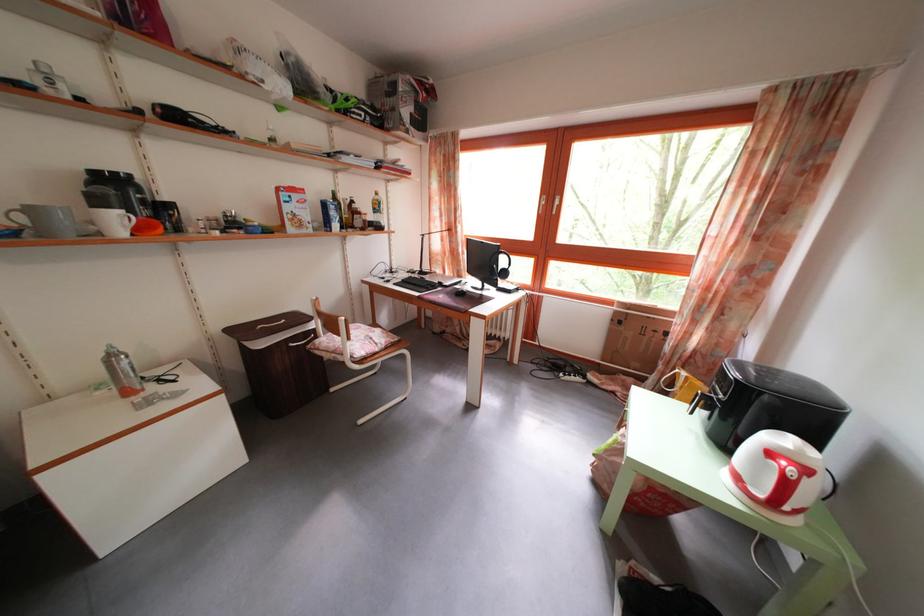
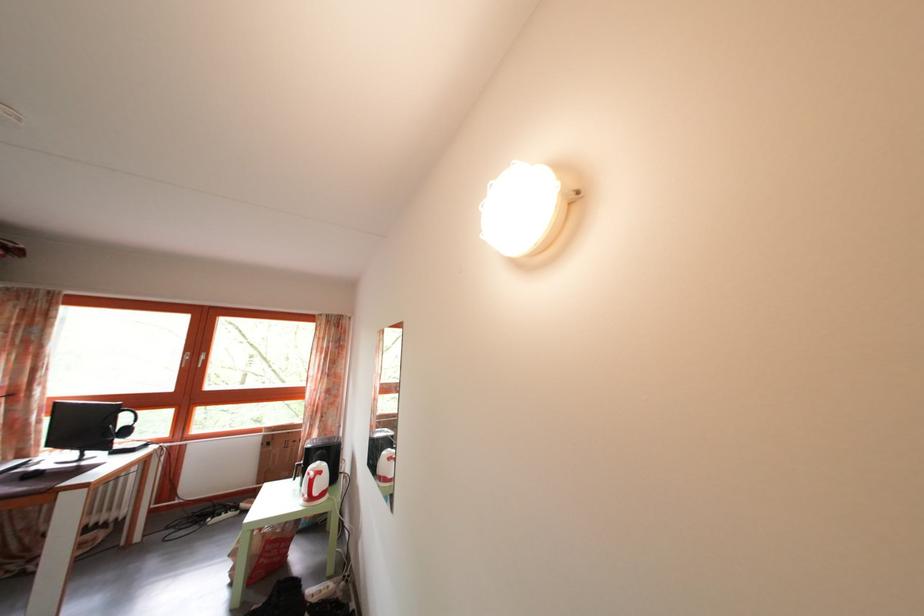
Locate, in the second image, the point that corresponds to (812,477) in the first image.

(327, 480)